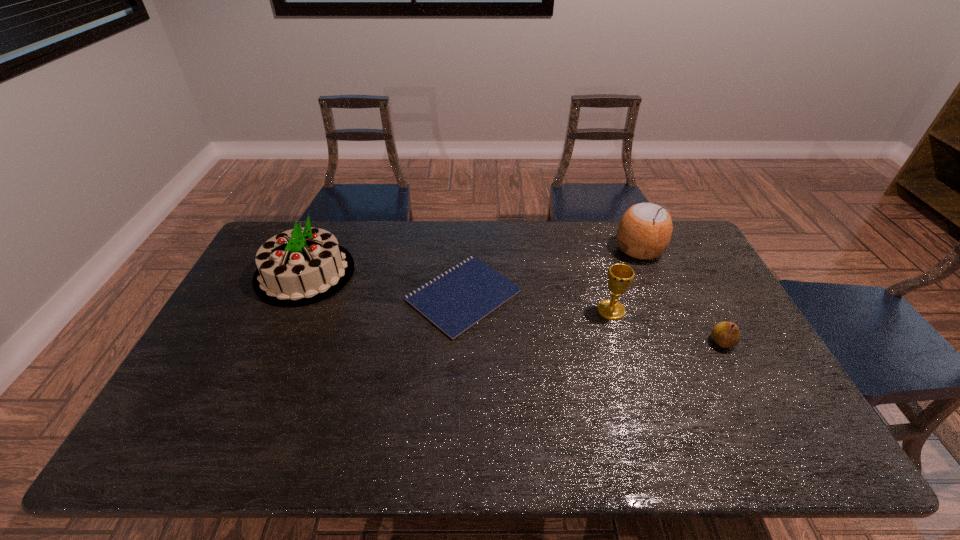
You are a GUI agent. You are given a task and a screenshot of the screen. Output one action in this format:
    pyautogui.click(x=<x>, y=<y>)
    Task: Click on the vacant space situated 0.170m on the back of the pear
    This screenshot has width=960, height=540.
    Given the screenshot: What is the action you would take?
    pyautogui.click(x=695, y=292)

Image resolution: width=960 pixels, height=540 pixels. I want to click on free spot located 0.320m on the right of the fourth object from right to left, so click(625, 295).

This screenshot has width=960, height=540. Identify the location of coconut located at the far edge. (644, 232).

This screenshot has height=540, width=960. What are the coordinates of `birthday cake that is at the far edge` in the screenshot? It's located at (302, 266).

The width and height of the screenshot is (960, 540). I want to click on notepad positioned at the far edge, so click(456, 300).

I want to click on object present at the left edge, so click(302, 266).

Where is `coconut that is at the right edge`? The image size is (960, 540). coconut that is at the right edge is located at coordinates pyautogui.click(x=644, y=232).

The image size is (960, 540). Find the location of `pear situated at the right edge`. pear situated at the right edge is located at coordinates (726, 334).

Where is `object situated at the far left corner`? object situated at the far left corner is located at coordinates (302, 266).

Locate an element on the screen. The height and width of the screenshot is (540, 960). object that is at the far right corner is located at coordinates (644, 232).